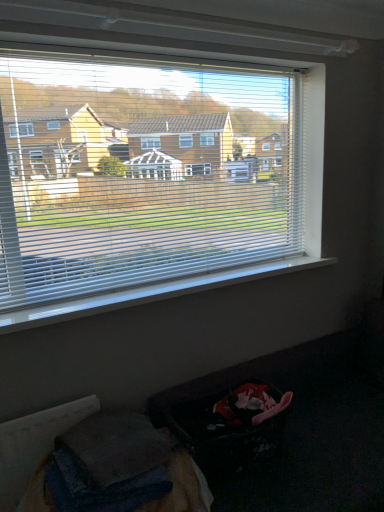
Locate an element on the screen. This screenshot has width=384, height=512. dark fabric laundry basket at lower center is located at coordinates (230, 426).

In order to face dark fabric laundry basket at lower center, should I rotate leftwards or rightwards?

To face it directly, rotate right by 5.350 degrees.

Describe the element at coordinates (230, 426) in the screenshot. I see `dark fabric laundry basket at lower center` at that location.

Where is `dark fabric laundry basket at lower center`? dark fabric laundry basket at lower center is located at coordinates (230, 426).